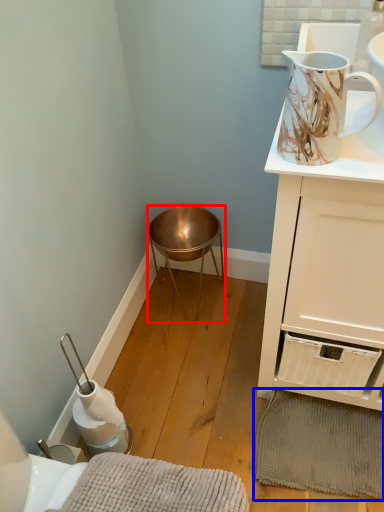
Question: Which of the following is the closest to the observer, stool (highlighted by a red box) or bath mat (highlighted by a blue box)?

Choices:
 (A) stool
 (B) bath mat

Answer: (B)